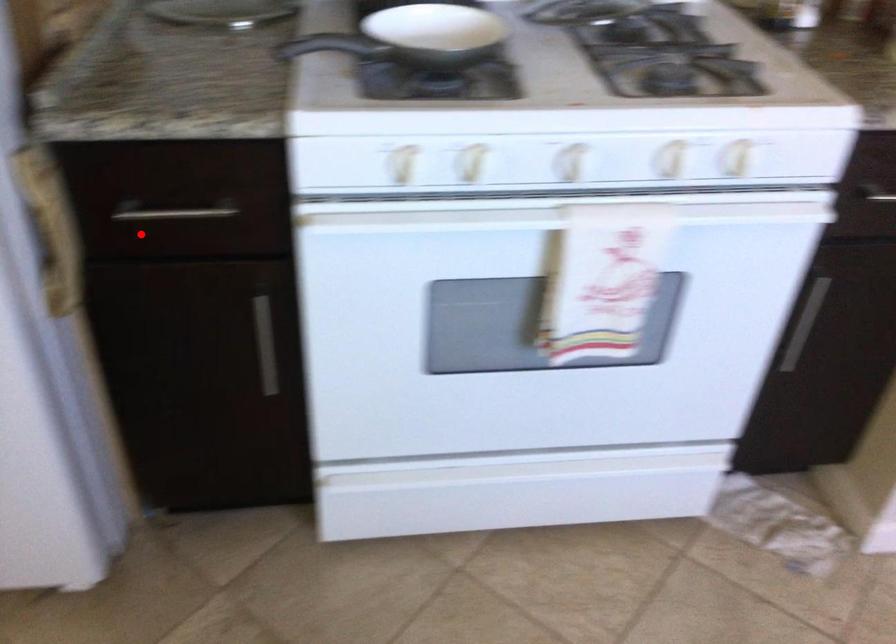
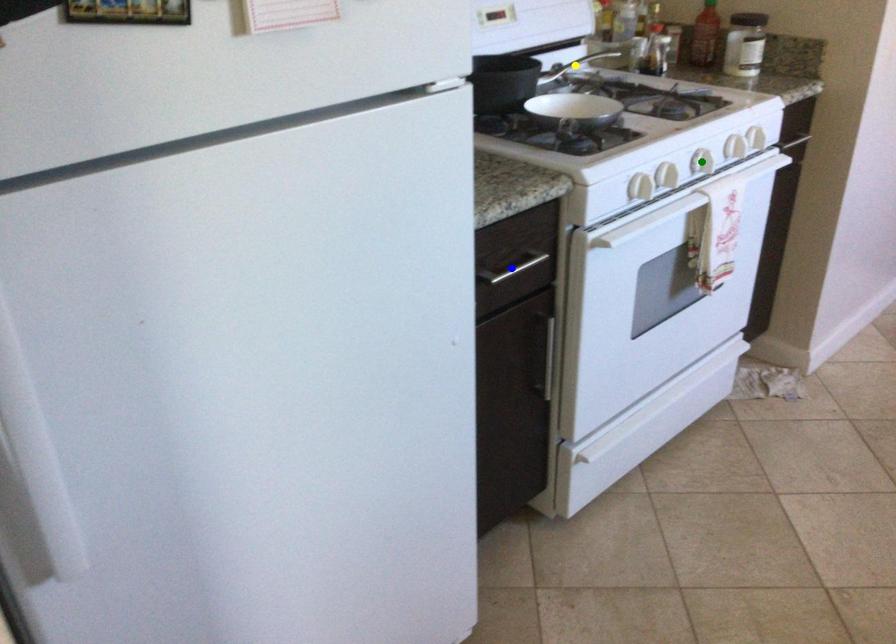
Question: I am providing you with two images of the same scene from different viewpoints. A red point is marked on the first image. You are given multiple points on the second image. Which point in image 2 is actually the same real-world point as the red point in image 1?

Choices:
 (A) blue point
 (B) green point
 (C) yellow point

Answer: (A)